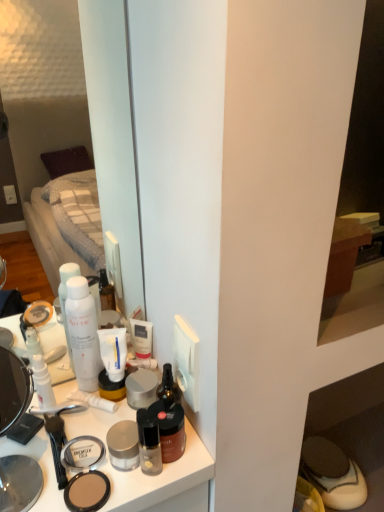
The image size is (384, 512). Find the location of `vacant area in front of white matte pump bottle at upper left, which is the fourth toiletry from right to left`. vacant area in front of white matte pump bottle at upper left, which is the fourth toiletry from right to left is located at coordinates (35, 453).